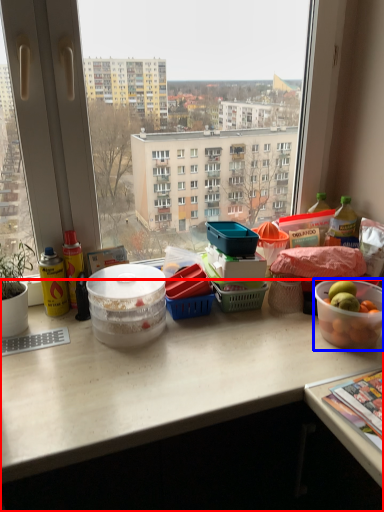
Question: Which point is closer to the camera, desk (highlighted by a red box) or bowl (highlighted by a blue box)?

Choices:
 (A) desk
 (B) bowl

Answer: (A)